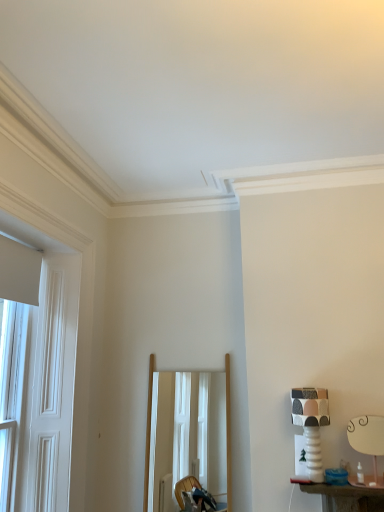
Question: Does point (152, 466) appear closer or farther from the camera than point (21, 406)?

Choices:
 (A) closer
 (B) farther

Answer: (B)

Question: In terms of width, does wooden frame mirror at center look wider or thinner when compared to white wooden door at left?

Choices:
 (A) thin
 (B) wide

Answer: (B)

Question: Considering the real-world distances, which object is farthest from the white ceramic table lamp at right, which is counted as the first table lamp, starting from the right?

Choices:
 (A) patterned ceramic table lamp at right, which ranks as the 1th table lamp in left-to-right order
 (B) white wooden door at left
 (C) wooden frame mirror at center

Answer: (B)

Question: Based on their relative distances, which object is farther from the white ceramic table lamp at right, which is counted as the first table lamp, starting from the right?

Choices:
 (A) patterned ceramic table lamp at right, which is the 2th table lamp in right-to-left order
 (B) white wooden door at left
 (C) wooden frame mirror at center

Answer: (B)